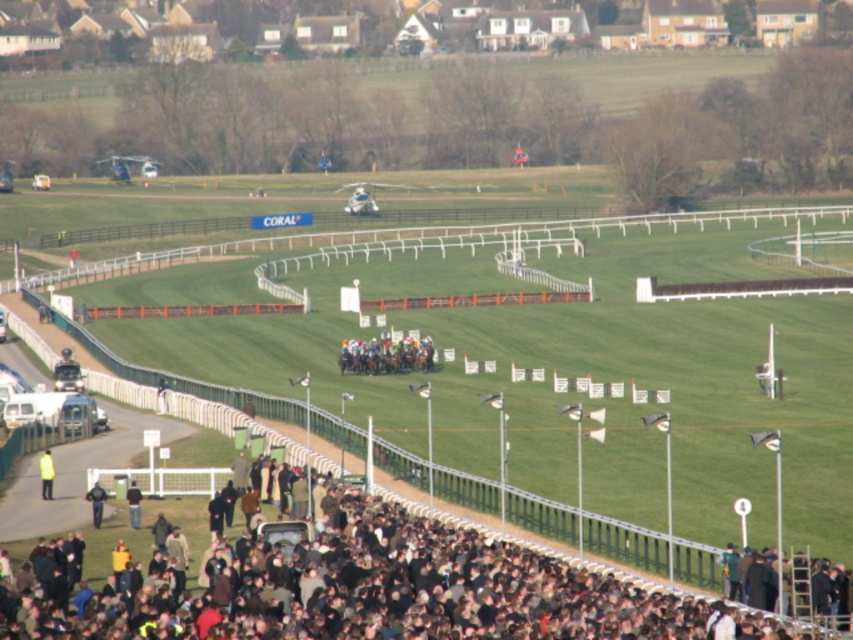
Question: Which of the following is the farthest from the observer?

Choices:
 (A) (128, 513)
 (B) (20, 636)
 (C) (45, 490)

Answer: (C)

Question: Is neon yellow jacket at lower left bigger than dark gray jacket at lower center?

Choices:
 (A) yes
 (B) no

Answer: (A)

Question: Which is farther from the dark gray jacket at lower center?

Choices:
 (A) dark brown fur coat at lower center
 (B) neon yellow jacket at lower left

Answer: (A)

Question: Among these points, which one is farthest from the camera?

Choices:
 (A) (137, 504)
 (B) (500, 621)
 (C) (47, 477)

Answer: (C)

Question: Can you confirm if dark brown fur coat at lower center is smaller than neon yellow jacket at lower left?

Choices:
 (A) no
 (B) yes

Answer: (A)

Question: Does dark brown fur coat at lower center appear on the left side of neon yellow jacket at lower left?

Choices:
 (A) no
 (B) yes

Answer: (A)